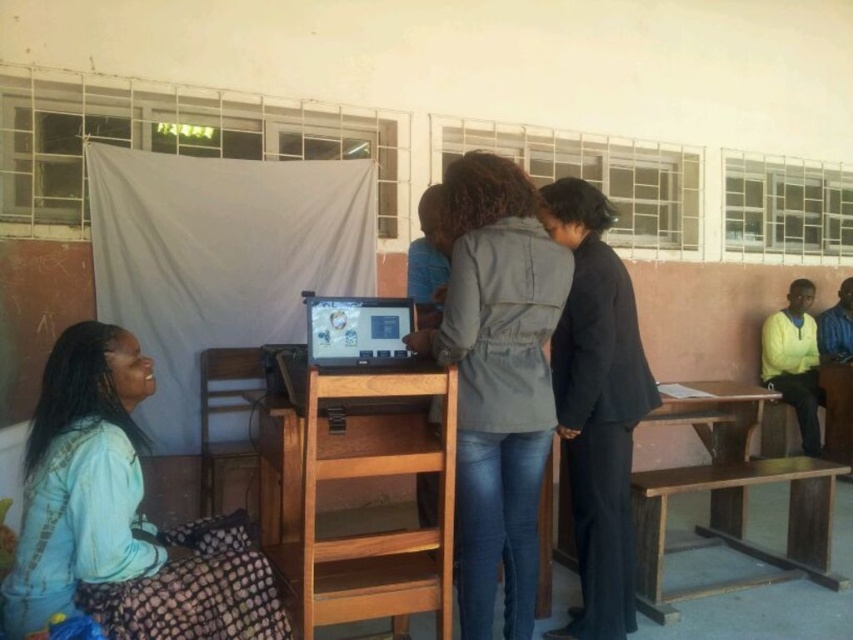
You are organizing a workshop in this classroom and need to place a 1.2 meter wide whiteboard between the brown wooden table at lower right and the matte black computer at center. Based on their sizes, will the whiteboard fit between them?

The brown wooden table at lower right is wider than the matte black computer at center. However, the combined width of both objects is not provided, so we cannot determine if the 1.2 meter whiteboard will fit between them based on the given information.

You are a photographer trying to capture a candid shot of the denim jacket at center and the light blue fabric skirt at lower left without them noticing. Which object should you focus on first to ensure both are in frame?

The denim jacket at center is positioned on the right side of light blue fabric skirt at lower left, so you should focus on the light blue fabric skirt at lower left first to ensure both are in frame.

You are standing at the entrance of the classroom and want to find the denim jacket at center. According to the coordinates given, in which direction should you walk to reach it?

The denim jacket at center is located at coordinates point (496, 378). Since the coordinate system is not specified, it is recommended to move towards the central area of the classroom to locate the denim jacket at center.